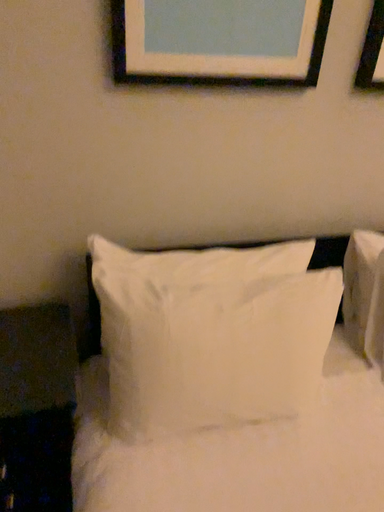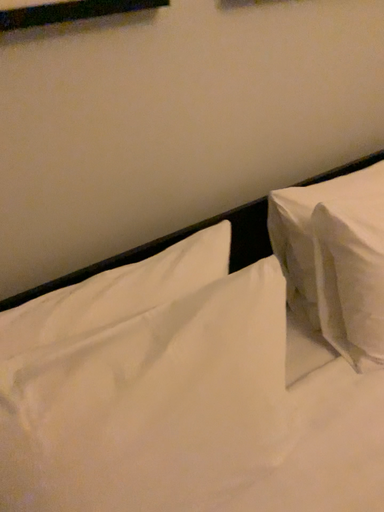
Question: Which way did the camera rotate in the video?

Choices:
 (A) rotated left
 (B) rotated right

Answer: (B)